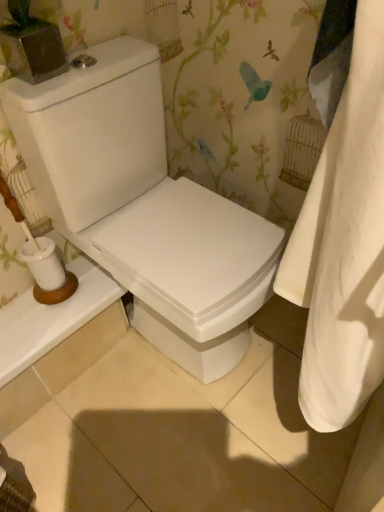
Image resolution: width=384 pixels, height=512 pixels. In order to click on free space in front of white glossy toilet at center in this screenshot , I will do `click(185, 441)`.